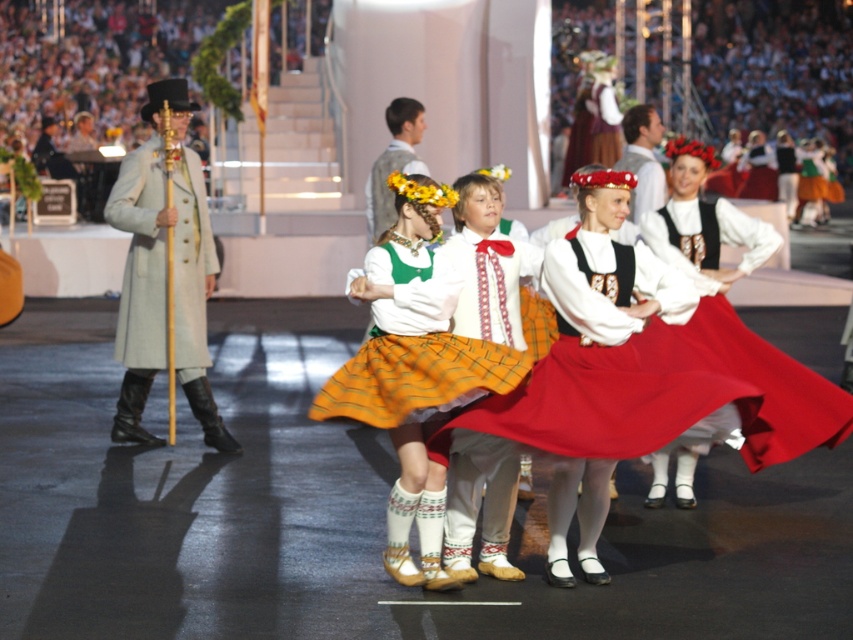
Question: Is the position of matte yellow skirt at center less distant than that of light beige wool coat at left?

Choices:
 (A) no
 (B) yes

Answer: (B)

Question: Is light beige wool coat at left thinner than matte red skirt at center?

Choices:
 (A) yes
 (B) no

Answer: (A)

Question: Which point appears closest to the camera in this image?

Choices:
 (A) (109, 202)
 (B) (456, 401)

Answer: (B)

Question: Which point is closer to the camera?

Choices:
 (A) matte yellow skirt at center
 (B) light beige wool coat at left
 (C) matte red skirt at center

Answer: (A)

Question: Is light beige wool coat at left below matte red skirt at center?

Choices:
 (A) yes
 (B) no

Answer: (A)

Question: Which point is closer to the camera?

Choices:
 (A) (405, 188)
 (B) (125, 378)
 (C) (767, 230)

Answer: (A)